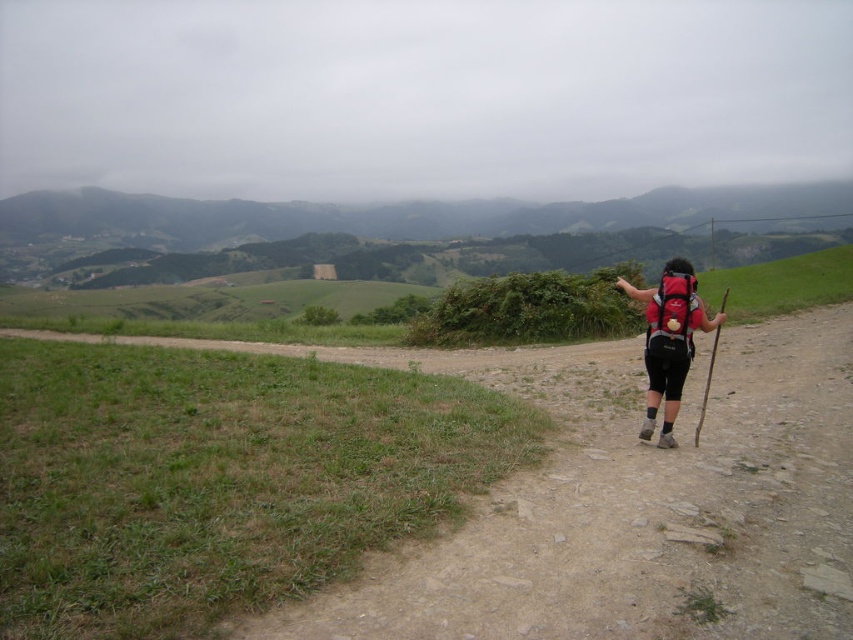
Question: Can you confirm if dirt path at right is positioned to the left of matte red backpack at right?

Choices:
 (A) no
 (B) yes

Answer: (B)

Question: Among these points, which one is nearest to the camera?

Choices:
 (A) (485, 616)
 (B) (666, 365)

Answer: (A)

Question: Which point is farther to the camera?

Choices:
 (A) dirt path at right
 (B) matte red backpack at right

Answer: (B)

Question: Is dirt path at right above matte red backpack at right?

Choices:
 (A) yes
 (B) no

Answer: (B)

Question: From the image, what is the correct spatial relationship of dirt path at right in relation to matte red backpack at right?

Choices:
 (A) below
 (B) above

Answer: (A)